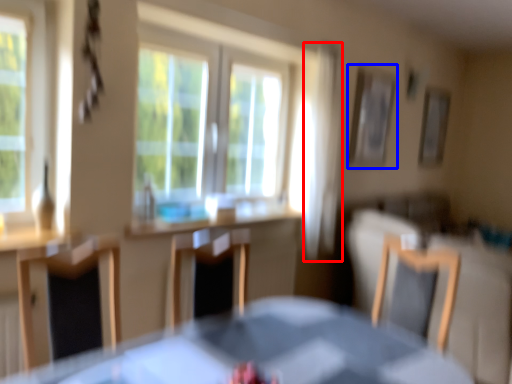
Question: Which object appears farthest to the camera in this image, curtain (highlighted by a red box) or picture frame (highlighted by a blue box)?

Choices:
 (A) curtain
 (B) picture frame

Answer: (B)